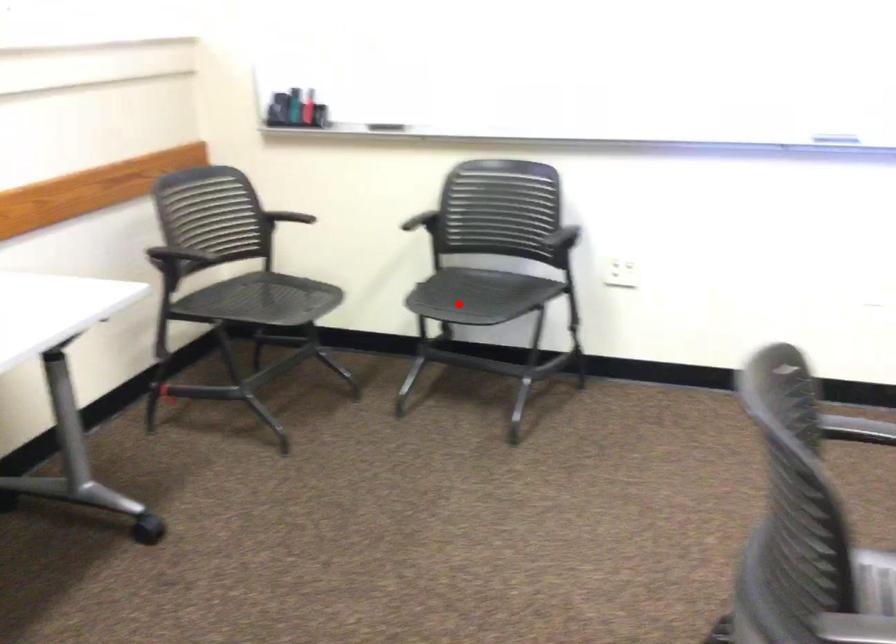
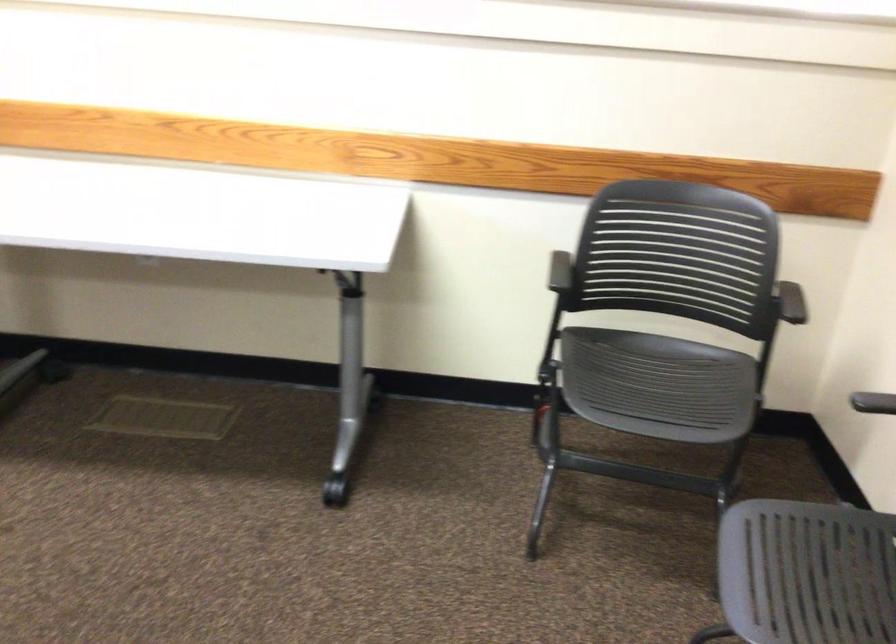
Question: I am providing you with two images of the same scene from different viewpoints. Image1 has a red point marked. In image2, the corresponding 3D location appears at what relative position? Reply with the corresponding letter.

Choices:
 (A) Closer
 (B) Farther

Answer: (A)